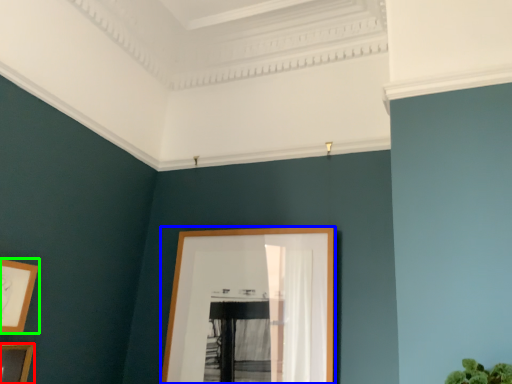
Question: Based on their relative distances, which object is nearer to picture frame (highlighted by a red box)? Choose from picture frame (highlighted by a blue box) and picture frame (highlighted by a green box).

Choices:
 (A) picture frame
 (B) picture frame

Answer: (B)